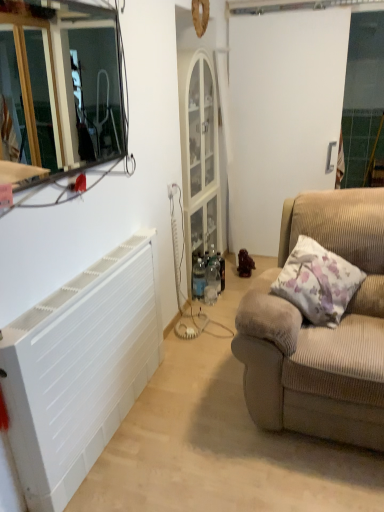
Where is `vacant area located to the right-hand side of white plastic radiator at left`? vacant area located to the right-hand side of white plastic radiator at left is located at coordinates click(213, 425).